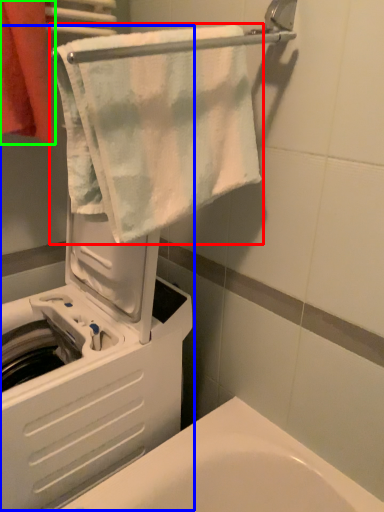
Question: Estimate the real-world distances between objects in this image. Which object is closer to towel (highlighted by a red box), machine (highlighted by a blue box) or towel (highlighted by a green box)?

Choices:
 (A) machine
 (B) towel

Answer: (B)